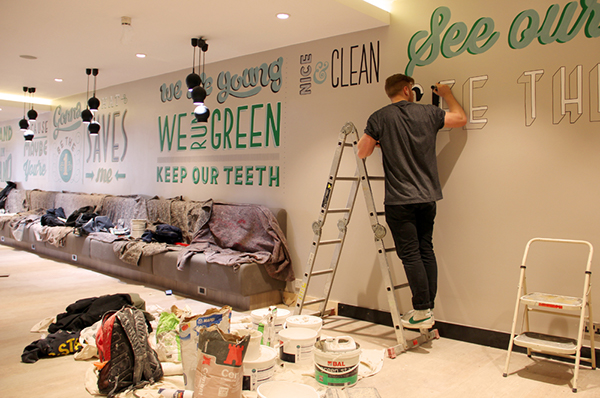
The height and width of the screenshot is (398, 600). Find the location of `floor`. floor is located at coordinates (46, 292).